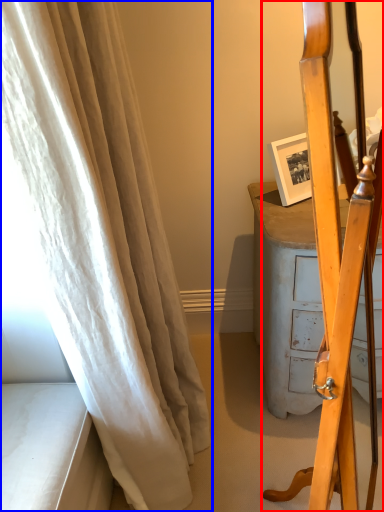
Question: Among these objects, which one is farthest to the camera, furniture (highlighted by a red box) or curtain (highlighted by a blue box)?

Choices:
 (A) furniture
 (B) curtain

Answer: (B)